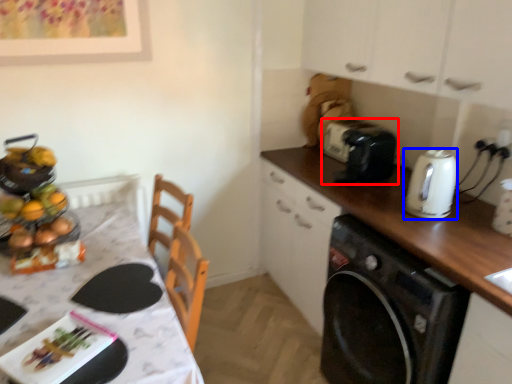
Question: Which object appears closest to the camera in this image, toaster (highlighted by a red box) or kitchen appliance (highlighted by a blue box)?

Choices:
 (A) toaster
 (B) kitchen appliance

Answer: (B)